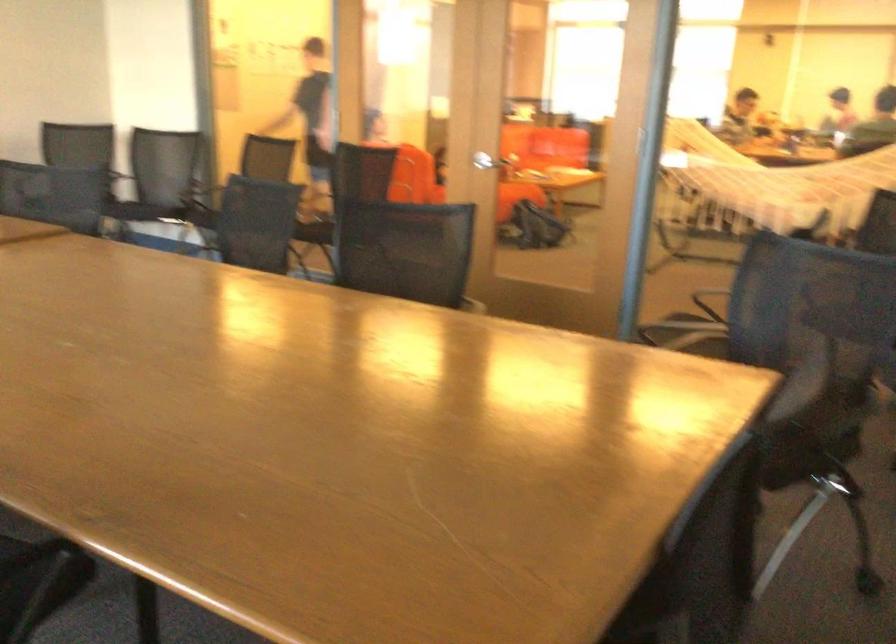
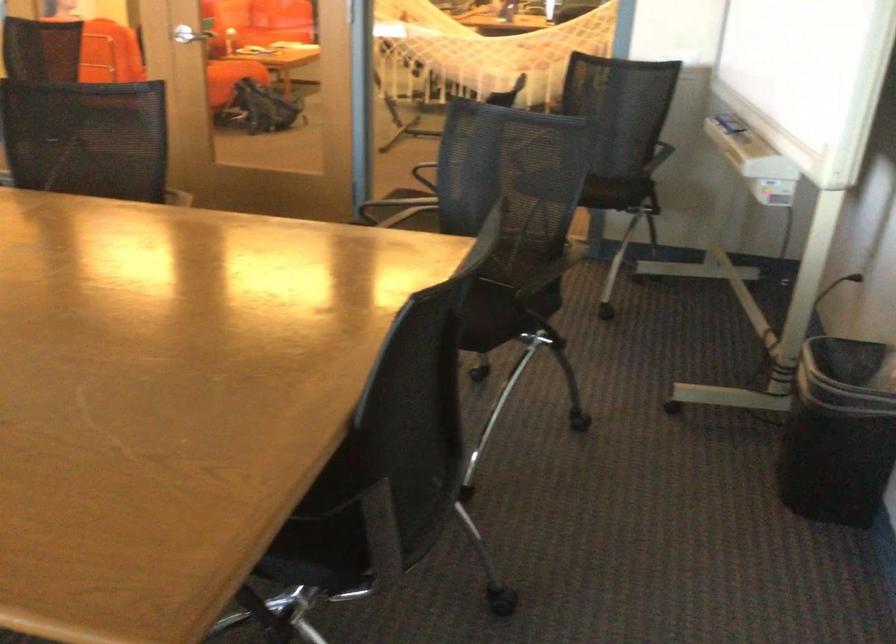
What movement of the cameraman would produce the second image?

The cameraman moved toward right, forward.